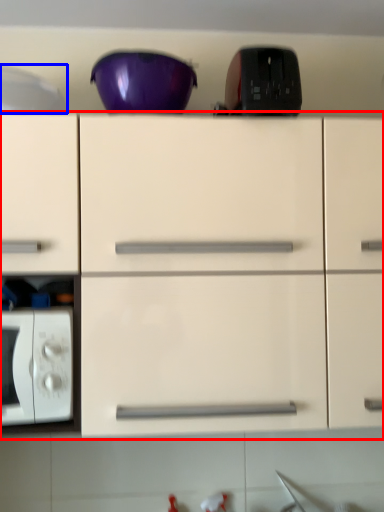
Question: Which object is further to the camera taking this photo, cabinetry (highlighted by a red box) or appliance (highlighted by a blue box)?

Choices:
 (A) cabinetry
 (B) appliance

Answer: (B)